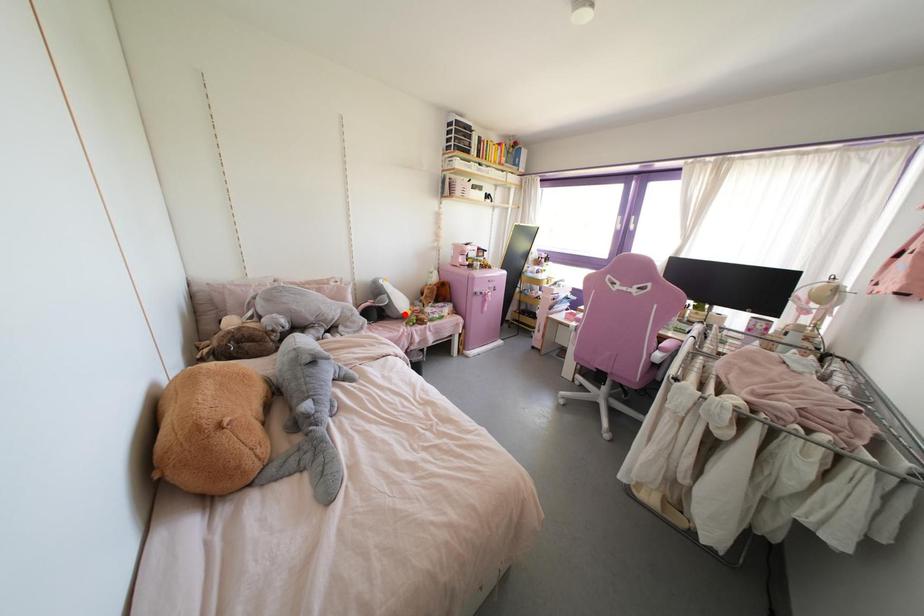
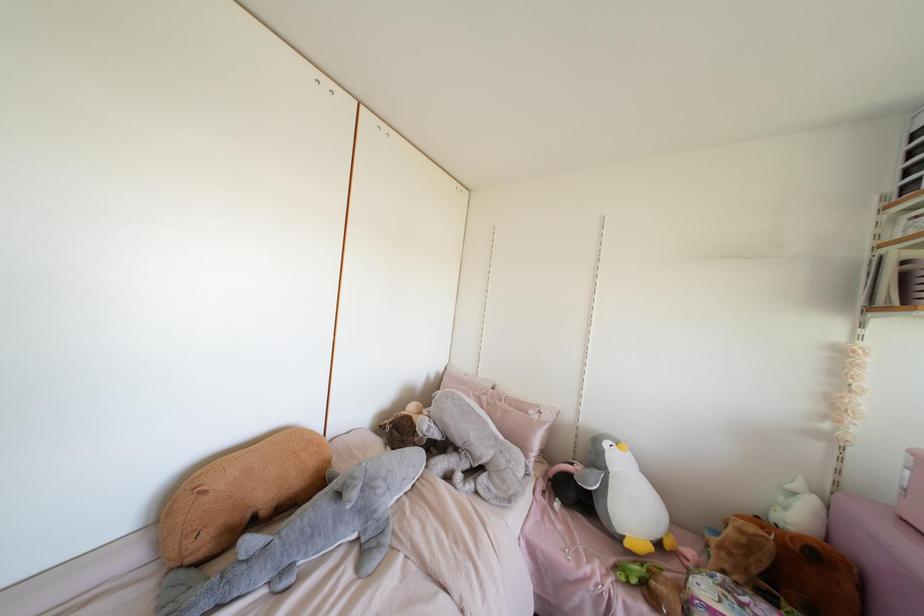
Question: I am providing you with two images of the same scene from different viewpoints. Image1 has a red point marked. In image2, the corresponding 3D location appears at what relative position? Reply with the corresponding letter.

Choices:
 (A) Closer
 (B) Farther

Answer: (B)